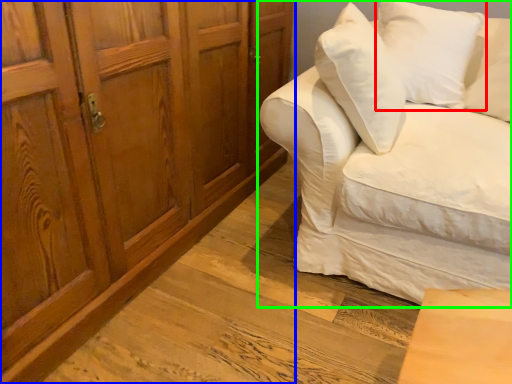
Question: Which object is positioned closest to pillow (highlighted by a red box)? Select from cabinetry (highlighted by a blue box) and studio couch (highlighted by a green box).

Choices:
 (A) cabinetry
 (B) studio couch

Answer: (B)